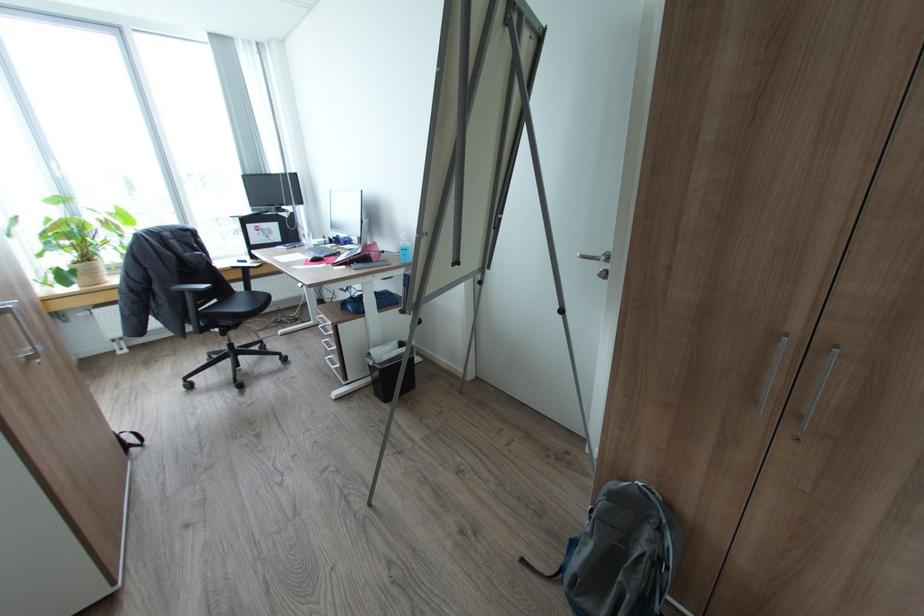
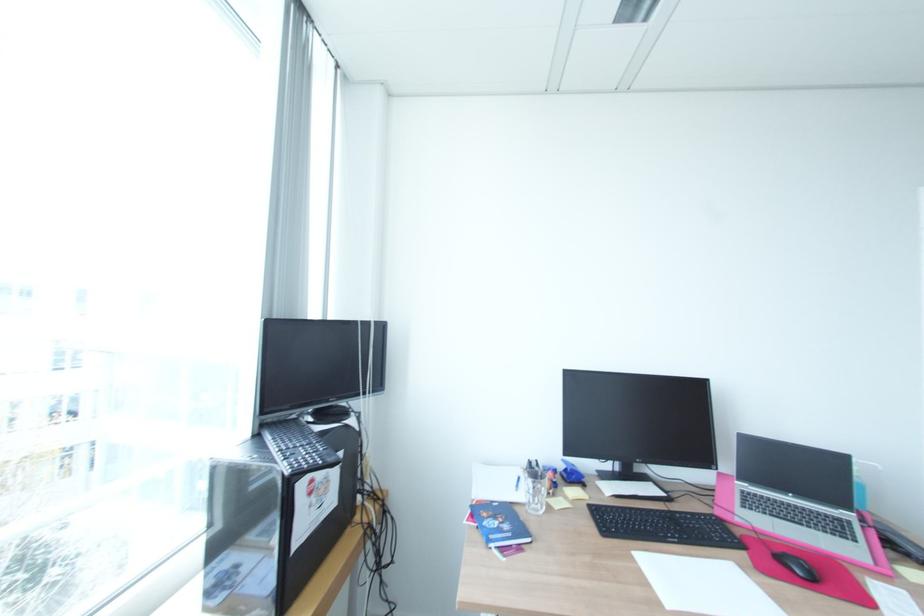
Where in the second image is the point corresponding to (x=295, y=172) from the first image?

(381, 321)